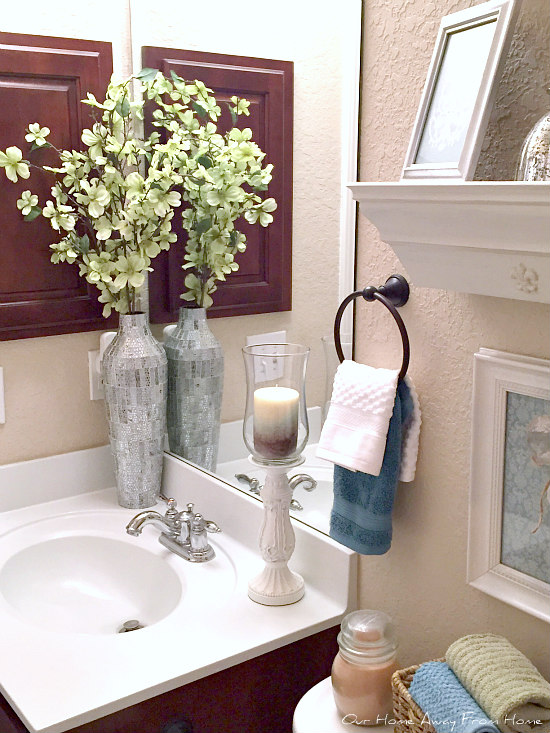
The height and width of the screenshot is (733, 550). In order to click on candle in this screenshot , I will do `click(346, 682)`, `click(275, 421)`.